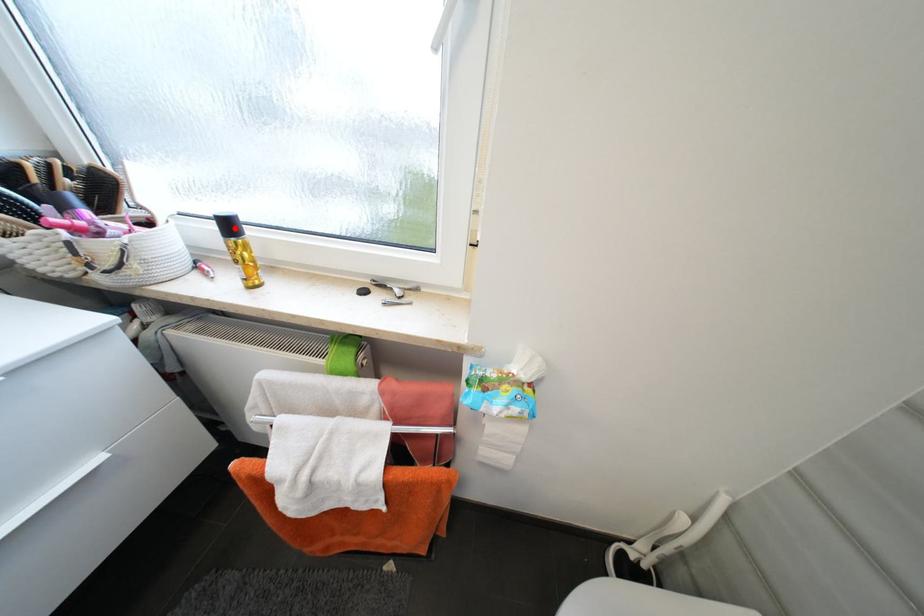
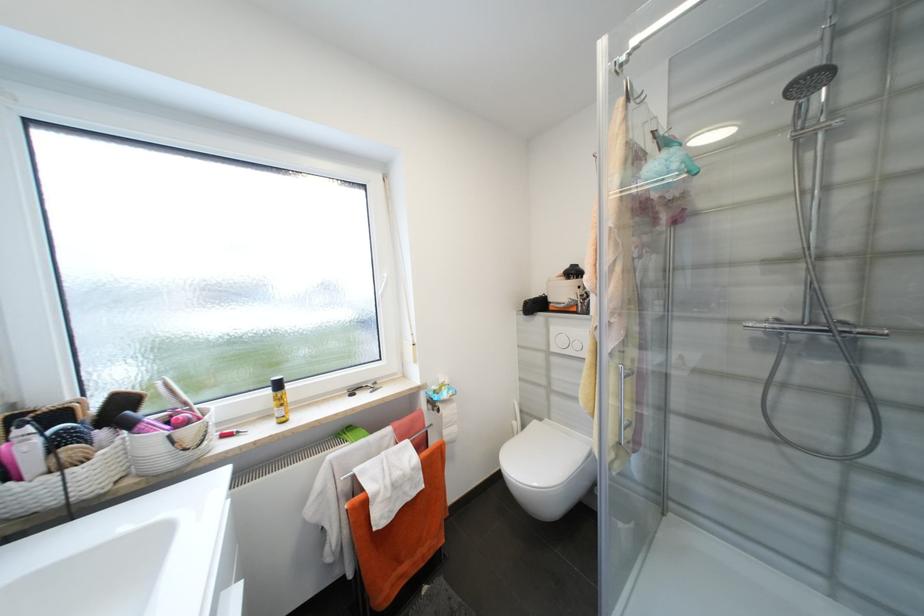
In the second image, find the point that corresponds to the highlighted location in the first image.

(284, 386)